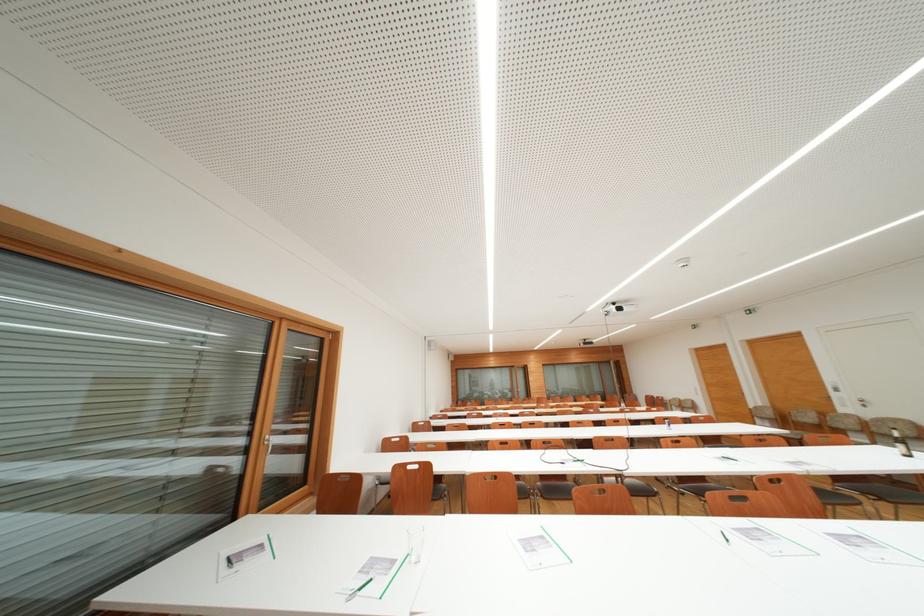
I want to click on silver window handle, so click(268, 444).